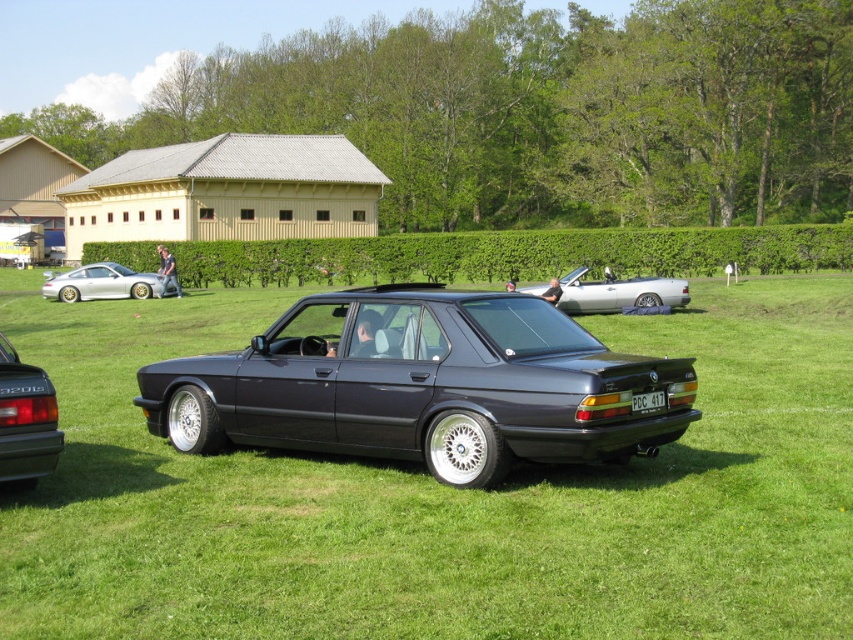
You are a photographer planning to capture the green leafy hedge at center and the silver metallic convertible at center in a single frame. Based on their sizes, which object will occupy more space in your photo?

The green leafy hedge at center is bigger than the silver metallic convertible at center, so it will occupy more space in the photo.